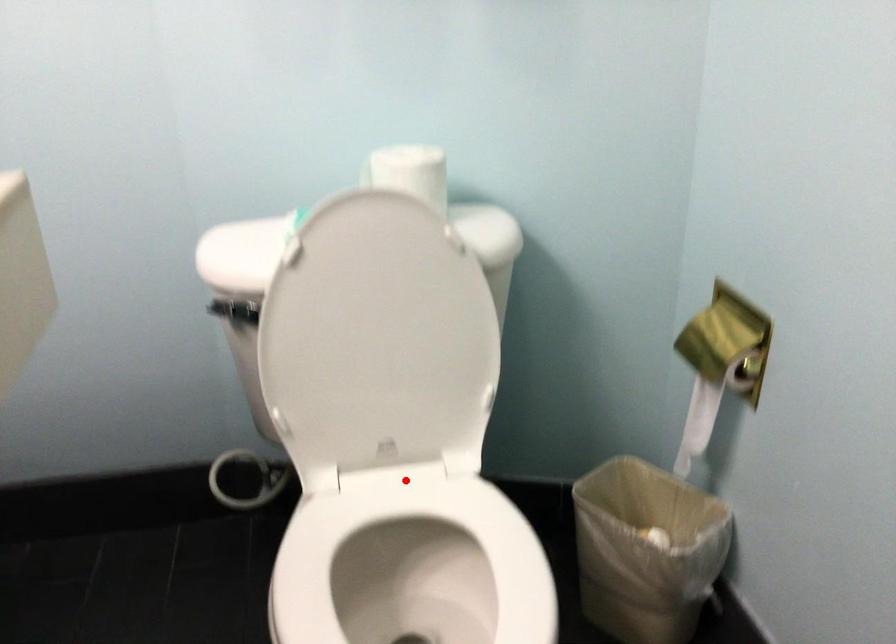
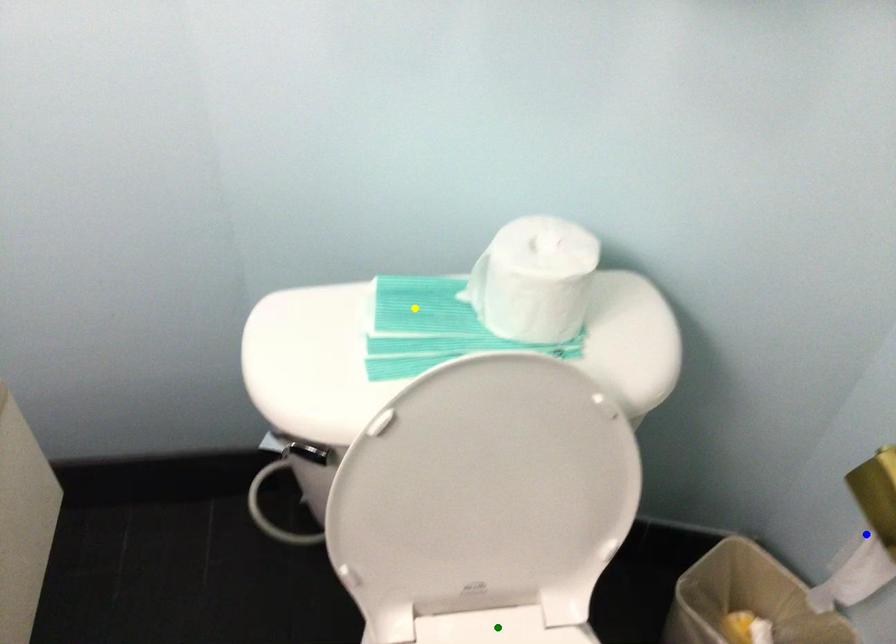
Question: I am providing you with two images of the same scene from different viewpoints. A red point is marked on the first image. You are given multiple points on the second image. Which point in image 2 is actually the same real-world point as the red point in image 1?

Choices:
 (A) green point
 (B) blue point
 (C) yellow point

Answer: (A)